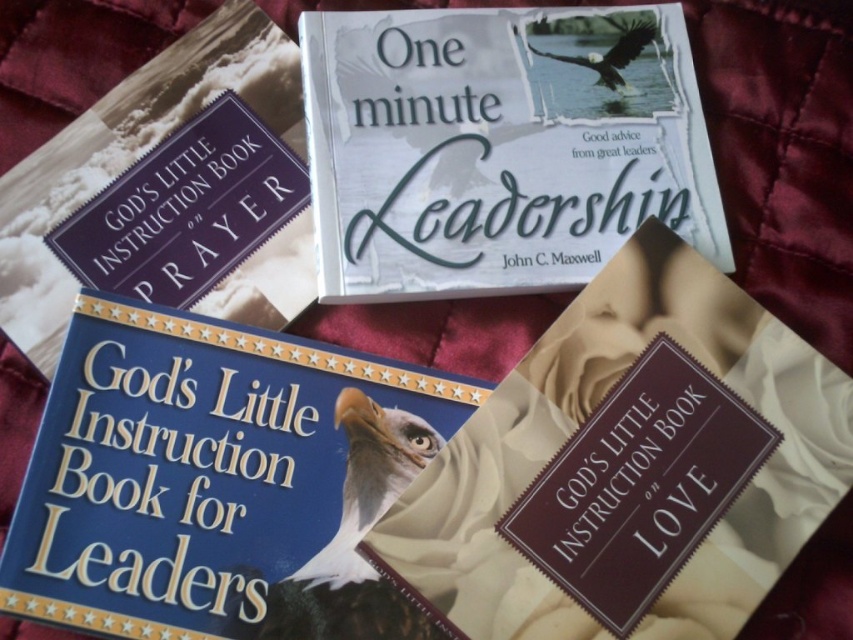
Question: Which object appears farthest from the camera in this image?

Choices:
 (A) blue hardcover book at center
 (B) matte blue book on the left

Answer: (B)

Question: Can you confirm if white paper book at center is positioned below matte brown book on love at lower right?

Choices:
 (A) yes
 (B) no

Answer: (B)

Question: Which of the following is the farthest from the observer?

Choices:
 (A) (102, 173)
 (B) (561, 364)

Answer: (A)

Question: Estimate the real-world distances between objects in this image. Which object is farther from the white paper book at center?

Choices:
 (A) blue hardcover book at center
 (B) matte brown book on love at lower right
 (C) matte blue book on the left

Answer: (A)

Question: Can you confirm if blue hardcover book at center is positioned below matte blue book on the left?

Choices:
 (A) yes
 (B) no

Answer: (A)

Question: Can you confirm if blue hardcover book at center is wider than matte blue book on the left?

Choices:
 (A) yes
 (B) no

Answer: (A)